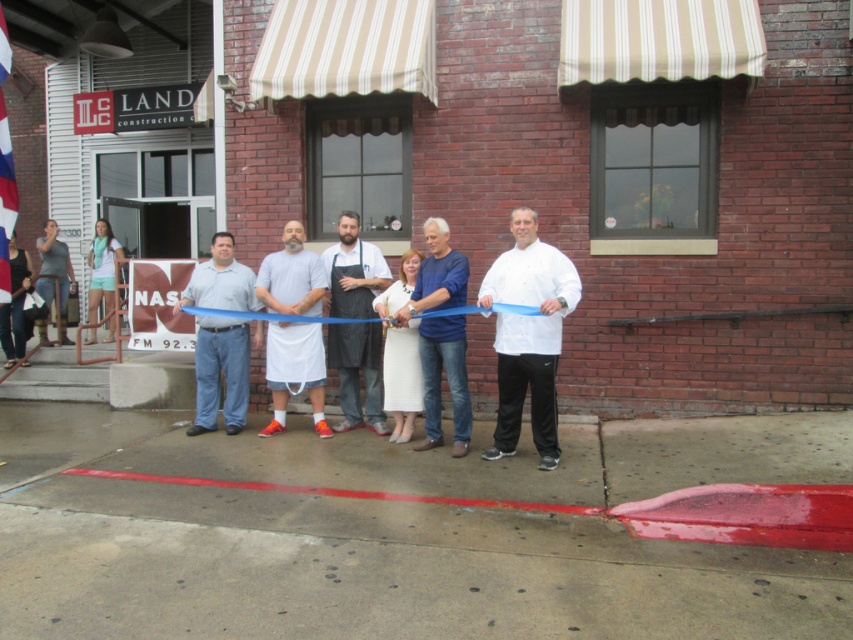
Who is positioned more to the left, white matte chef coat at center or white matte apron at center?

white matte apron at center

Can you confirm if white matte chef coat at center is positioned above white matte apron at center?

Actually, white matte chef coat at center is below white matte apron at center.

Image resolution: width=853 pixels, height=640 pixels. Identify the location of white matte chef coat at center. (527, 336).

Does white matte apron at center appear under blue cotton shirt at center?

No, white matte apron at center is not below blue cotton shirt at center.

Is point (380, 282) positioned after point (457, 376)?

Yes.

Which is behind, point (331, 250) or point (425, 230)?

The point (331, 250) is more distant.

Where is `white matte apron at center`? This screenshot has height=640, width=853. white matte apron at center is located at coordinates (357, 372).

What do you see at coordinates (527, 336) in the screenshot? I see `white matte chef coat at center` at bounding box center [527, 336].

Between white matte chef coat at center and gray cotton shirt at center, which one has more height?

white matte chef coat at center is taller.

Who is more distant from viewer, (566, 280) or (248, 289)?

Point (248, 289)

The image size is (853, 640). In order to click on white matte chef coat at center in this screenshot , I will do `click(527, 336)`.